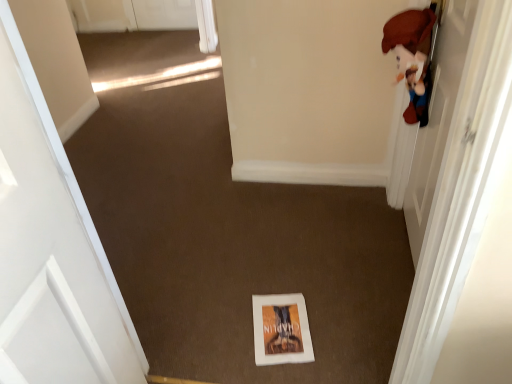
Find the location of `free space that is to the left of white glossy door at upper right, positioned as the 2th door in left-to-right order`. free space that is to the left of white glossy door at upper right, positioned as the 2th door in left-to-right order is located at coordinates pyautogui.click(x=311, y=274).